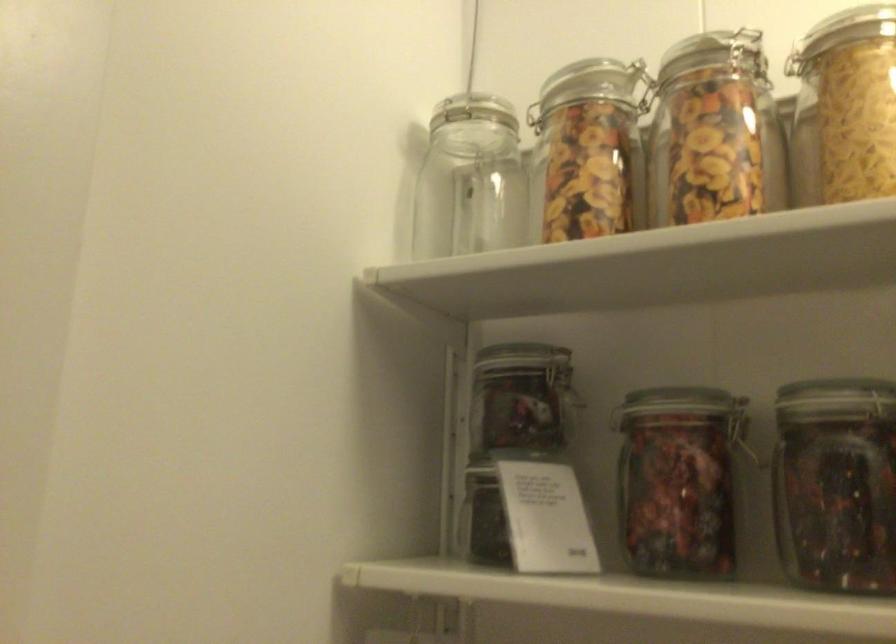
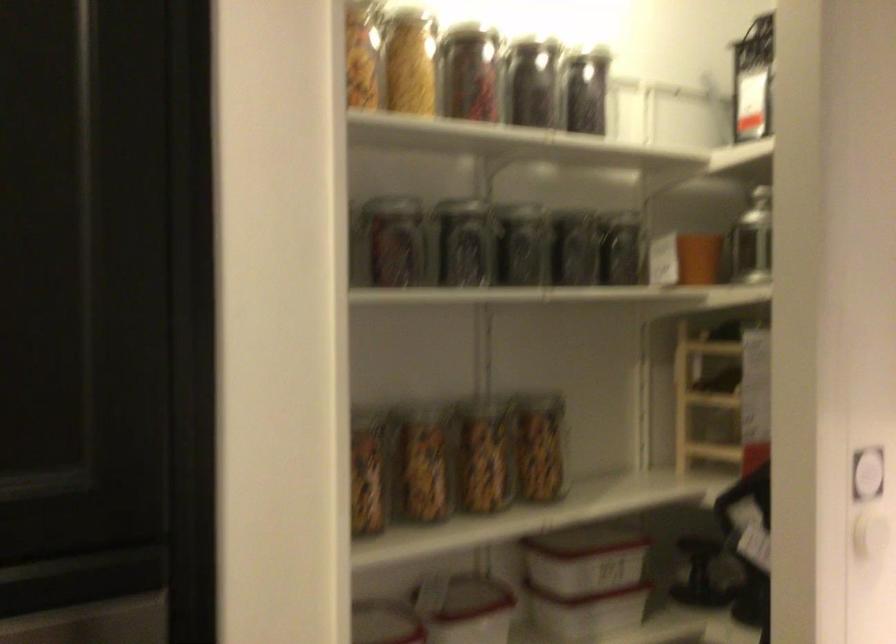
Find the pixel in the second image that matches (711,129) in the first image.

(363, 53)